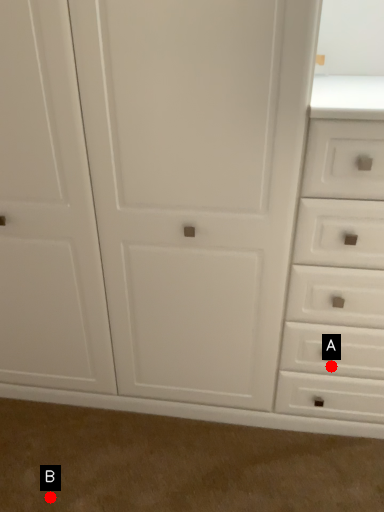
Question: Two points are circled on the image, labeled by A and B beside each circle. Which point is closer to the camera taking this photo?

Choices:
 (A) A is closer
 (B) B is closer

Answer: (B)